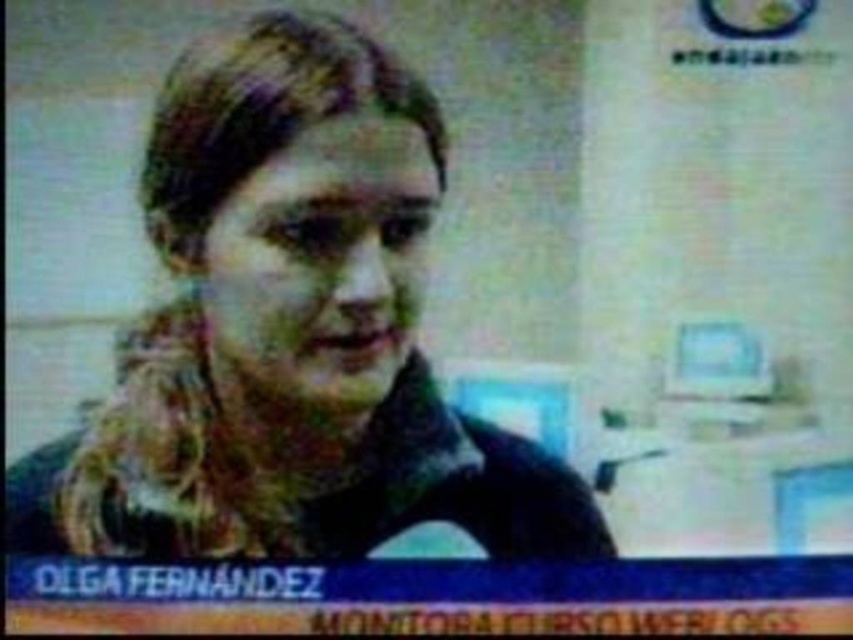
Question: Is smooth skin face at center behind light blue plastic monitor at upper right?

Choices:
 (A) no
 (B) yes

Answer: (A)

Question: Which point is closer to the camera taking this photo?

Choices:
 (A) (318, 378)
 (B) (686, 355)

Answer: (A)

Question: Can you confirm if smooth skin face at center is positioned above light blue plastic monitor at upper right?

Choices:
 (A) yes
 (B) no

Answer: (A)

Question: Can you confirm if dark brown hair at center is wider than smooth skin face at center?

Choices:
 (A) no
 (B) yes

Answer: (B)

Question: Estimate the real-world distances between objects in this image. Which object is farther from the light blue plastic monitor at upper right?

Choices:
 (A) smooth skin face at center
 (B) dark brown hair at center

Answer: (B)

Question: Which point is farther from the camera taking this photo?

Choices:
 (A) (672, 337)
 (B) (347, 339)
 (C) (328, 88)

Answer: (A)